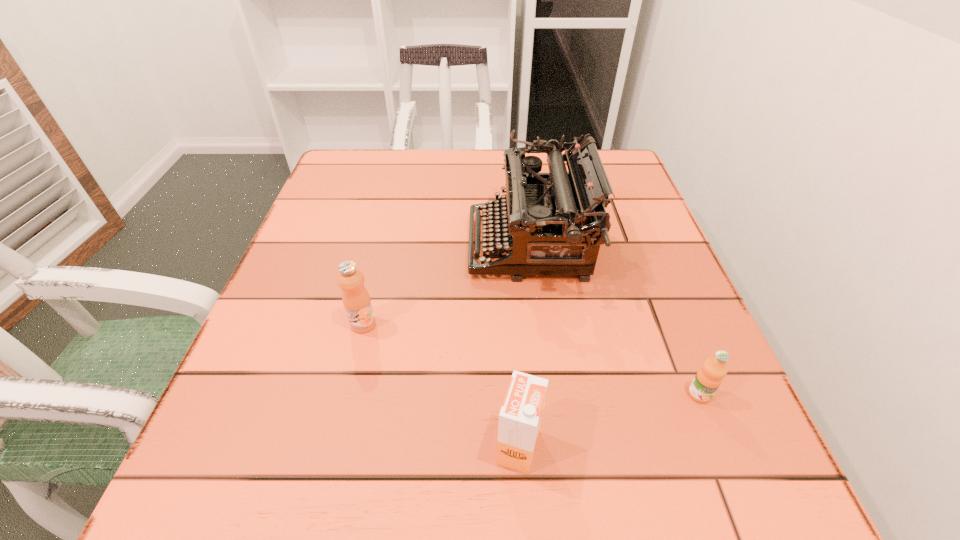
At what (x,y) coordinates should I click in order to perform the action: click on free area in between the second orange juice from right to left and the second nearest orange juice. Please return your answer as a coordinate pair (x, y). This screenshot has width=960, height=540. Looking at the image, I should click on (609, 421).

At what (x,y) coordinates should I click in order to perform the action: click on free space between the nearest object and the rightmost object. Please return your answer as a coordinate pair (x, y). The height and width of the screenshot is (540, 960). Looking at the image, I should click on (609, 421).

You are a GUI agent. You are given a task and a screenshot of the screen. Output one action in this format:
    pyautogui.click(x=<x>, y=<y>)
    Task: Click on the unoccupied area between the nearest orange juice and the rightmost object
    The image size is (960, 540).
    Given the screenshot: What is the action you would take?
    609,421

Where is `free spot between the second farthest object and the second nearest orange juice`? This screenshot has width=960, height=540. free spot between the second farthest object and the second nearest orange juice is located at coordinates (531, 359).

Image resolution: width=960 pixels, height=540 pixels. In order to click on free area in between the second farthest object and the nearest orange juice in this screenshot , I will do `click(441, 386)`.

Locate an element on the screen. The height and width of the screenshot is (540, 960). vacant area that lies between the second nearest object and the nearest object is located at coordinates (609, 421).

What are the coordinates of `vacant area that lies between the shortest orange juice and the leftmost object` in the screenshot? It's located at (531, 359).

The width and height of the screenshot is (960, 540). Identify the location of object that is the third closest one to the second orange juice from left to right. (356, 300).

This screenshot has width=960, height=540. In order to click on object that stands as the third closest to the second orange juice from left to right in this screenshot , I will do pos(356,300).

Point out which orange juice is positioned as the second nearest to the rightmost orange juice. Please provide its 2D coordinates. Your answer should be formatted as a tuple, i.e. [(x, y)], where the tuple contains the x and y coordinates of a point satisfying the conditions above.

[(356, 300)]